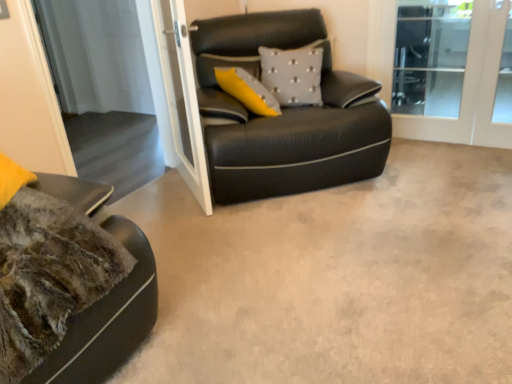
The image size is (512, 384). I want to click on free space in front of clear glass screen door at upper right, marked as the first screen door in a right-to-left arrangement, so click(x=442, y=156).